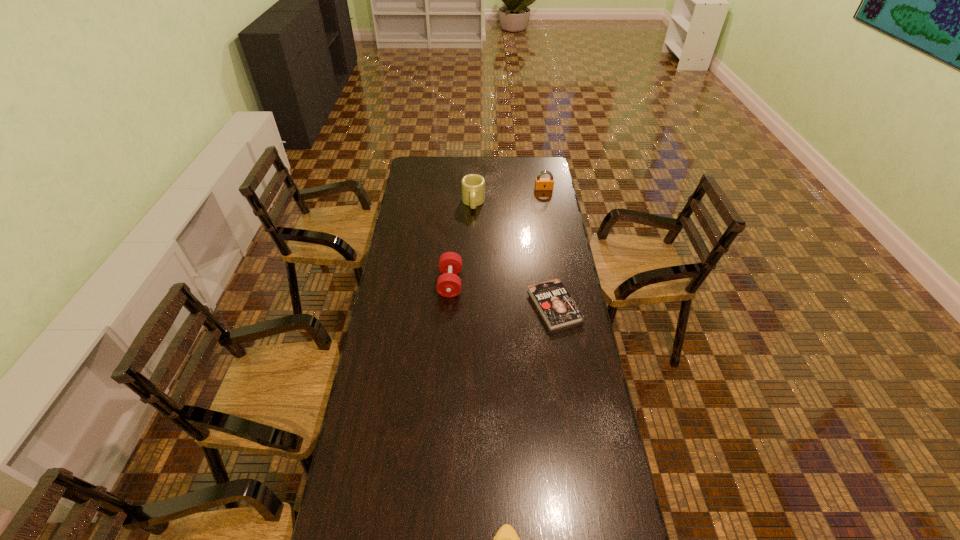
Locate an element on the screen. The width and height of the screenshot is (960, 540). vacant space that is in between the shortest object and the farthest object is located at coordinates (549, 247).

Locate an element on the screen. vacant space that is in between the mug and the book is located at coordinates (514, 254).

Find the location of `object that stands as the closest to the dumbbell`. object that stands as the closest to the dumbbell is located at coordinates (558, 309).

Identify the location of object that stands as the second closest to the nearest object. The height and width of the screenshot is (540, 960). (450, 263).

Where is `vacant point that satisfies the following two spatial constraints: 1. with the handle on the side of the book; 2. on the left side of the fourth nearest object`? The image size is (960, 540). vacant point that satisfies the following two spatial constraints: 1. with the handle on the side of the book; 2. on the left side of the fourth nearest object is located at coordinates (471, 306).